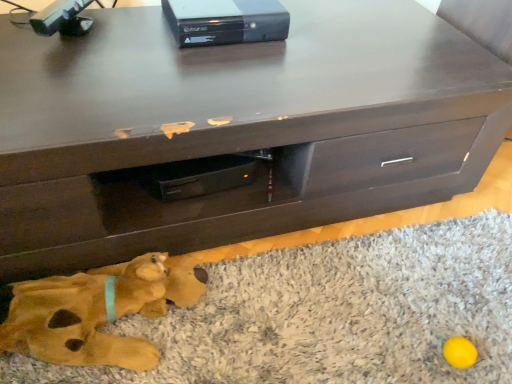
Question: Is the position of soft plush rug at lower center more distant than that of black plastic game console at upper center?

Choices:
 (A) no
 (B) yes

Answer: (A)

Question: Is soft plush rug at lower center wider than black plastic game console at upper center?

Choices:
 (A) no
 (B) yes

Answer: (B)

Question: Is soft plush rug at lower center beside black plastic game console at upper center?

Choices:
 (A) yes
 (B) no

Answer: (B)

Question: Does soft plush rug at lower center appear on the right side of black plastic game console at upper center?

Choices:
 (A) no
 (B) yes

Answer: (B)

Question: From a real-world perspective, is soft plush rug at lower center located beneath black plastic game console at upper center?

Choices:
 (A) no
 (B) yes

Answer: (B)

Question: In terms of size, does soft plush dog at lower left appear bigger or smaller than dark wood chest of drawers at center?

Choices:
 (A) big
 (B) small

Answer: (B)

Question: Visually, is soft plush dog at lower left positioned to the left or to the right of dark wood chest of drawers at center?

Choices:
 (A) right
 (B) left

Answer: (B)

Question: From the image's perspective, is soft plush dog at lower left located above or below dark wood chest of drawers at center?

Choices:
 (A) below
 (B) above

Answer: (A)

Question: Is soft plush dog at lower left in front of or behind dark wood chest of drawers at center in the image?

Choices:
 (A) front
 (B) behind

Answer: (B)

Question: In the image, is soft plush rug at lower center on the left side or the right side of black plastic game console at upper center?

Choices:
 (A) left
 (B) right

Answer: (B)

Question: In terms of width, does soft plush rug at lower center look wider or thinner when compared to black plastic game console at upper center?

Choices:
 (A) wide
 (B) thin

Answer: (A)

Question: Considering the positions of soft plush rug at lower center and black plastic game console at upper center in the image, is soft plush rug at lower center taller or shorter than black plastic game console at upper center?

Choices:
 (A) short
 (B) tall

Answer: (A)

Question: From a real-world perspective, is soft plush rug at lower center physically located above or below black plastic game console at upper center?

Choices:
 (A) below
 (B) above

Answer: (A)

Question: From a real-world perspective, is dark wood chest of drawers at center above or below black plastic game console at upper center?

Choices:
 (A) above
 (B) below

Answer: (B)

Question: From the image's perspective, is dark wood chest of drawers at center located above or below black plastic game console at upper center?

Choices:
 (A) below
 (B) above

Answer: (A)